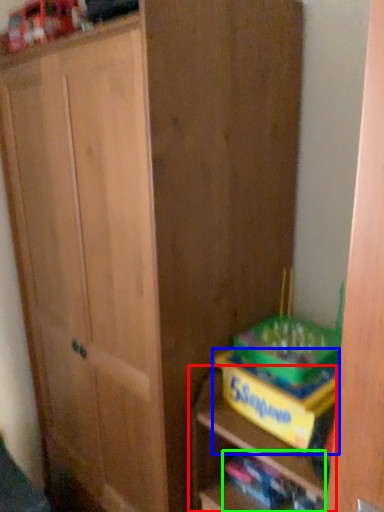
Question: Which object is the farthest from shelf (highlighted by a red box)? Choose among these: cabinetry (highlighted by a blue box) or book (highlighted by a green box).

Choices:
 (A) cabinetry
 (B) book

Answer: (B)